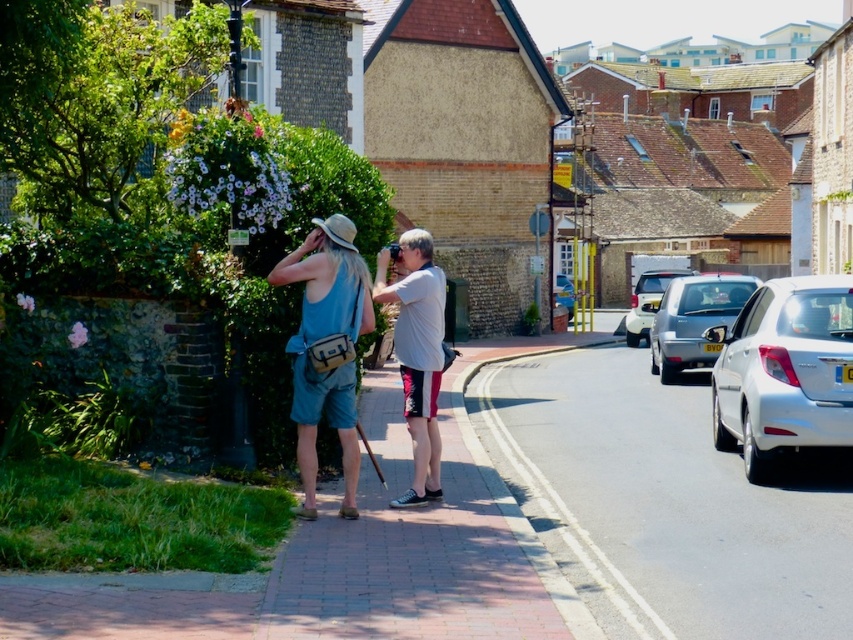
Question: Which point is closer to the camera taking this photo?

Choices:
 (A) (415, 248)
 (B) (706, 342)
 (C) (764, 397)

Answer: (A)

Question: Does silver metallic sedan at right have a smaller size compared to white glossy sedan at center-right?

Choices:
 (A) yes
 (B) no

Answer: (A)

Question: Considering the real-world distances, which object is closest to the white glossy sedan at center-right?

Choices:
 (A) white glossy sedan at right
 (B) blue fabric tank top at center
 (C) silver metallic sedan at right

Answer: (C)

Question: Can you confirm if white cotton t-shirt at center is smaller than silver metallic sedan at center-right?

Choices:
 (A) yes
 (B) no

Answer: (A)

Question: Which of the following is the closest to the observer?

Choices:
 (A) (691, 333)
 (B) (640, 296)
 (C) (306, 433)

Answer: (C)

Question: Does white glossy sedan at right have a smaller size compared to silver metallic sedan at center-right?

Choices:
 (A) no
 (B) yes

Answer: (B)